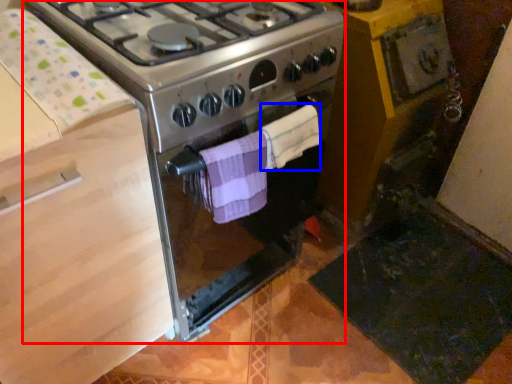
Question: Which object appears closest to the camera in this image, gas stove (highlighted by a red box) or towel/napkin (highlighted by a blue box)?

Choices:
 (A) gas stove
 (B) towel/napkin

Answer: (A)